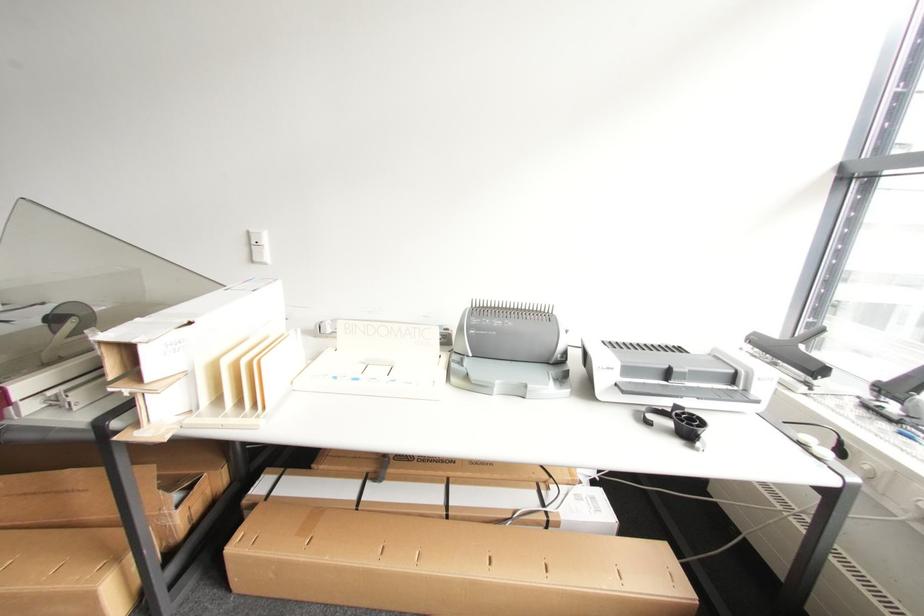
This screenshot has height=616, width=924. What do you see at coordinates (791, 354) in the screenshot? I see `the black machine lever` at bounding box center [791, 354].